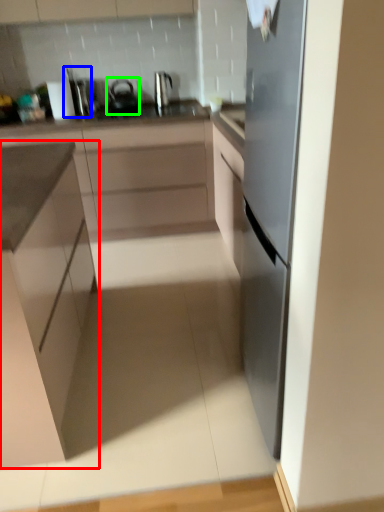
Question: Based on their relative distances, which object is nearer to cabinetry (highlighted by a red box)? Choose from appliance (highlighted by a blue box) and tea pot (highlighted by a green box).

Choices:
 (A) appliance
 (B) tea pot

Answer: (B)